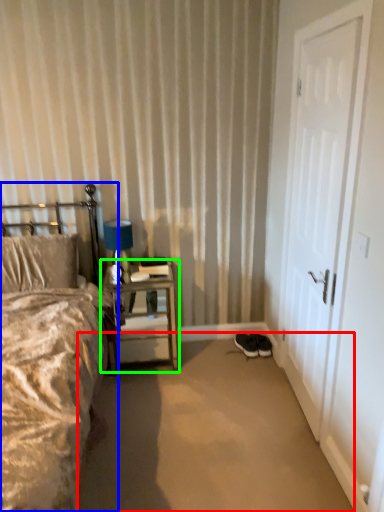
Question: Which object is positioned farthest from plain (highlighted by a red box)? Select from bed (highlighted by a blue box) and nightstand (highlighted by a green box).

Choices:
 (A) bed
 (B) nightstand

Answer: (A)